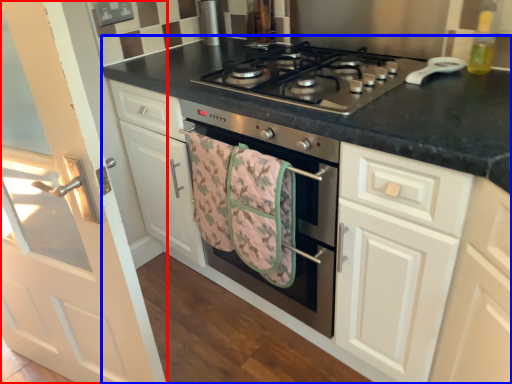
Question: Which object is closer to the camera taking this photo, door (highlighted by a red box) or countertop (highlighted by a blue box)?

Choices:
 (A) door
 (B) countertop

Answer: (A)